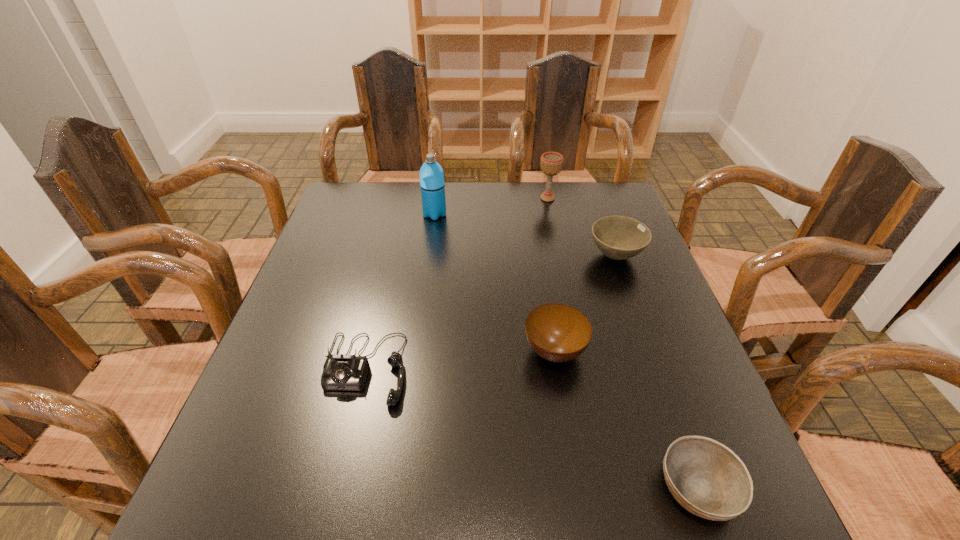
Identify the location of vacant area that lies between the second tallest object and the second nearest bowl. The height and width of the screenshot is (540, 960). (551, 275).

Find the location of a particular element. free spot between the fifth shortest object and the fifth nearest object is located at coordinates (492, 206).

Locate an element on the screen. This screenshot has height=540, width=960. empty space between the third farthest object and the second nearest bowl is located at coordinates (585, 303).

Where is `free spot between the telephone and the nearest bowl`? This screenshot has width=960, height=540. free spot between the telephone and the nearest bowl is located at coordinates (532, 428).

Locate an element on the screen. The height and width of the screenshot is (540, 960). blank region between the shortest object and the leftmost bowl is located at coordinates (626, 419).

Identify which object is located as the third nearest to the telephone. Please provide its 2D coordinates. Your answer should be formatted as a tuple, i.e. [(x, y)], where the tuple contains the x and y coordinates of a point satisfying the conditions above.

[(708, 479)]

At what (x,y) coordinates should I click in order to perform the action: click on object that is the fourth closest one to the farthest object. Please return your answer as a coordinate pair (x, y). Looking at the image, I should click on (345, 372).

I want to click on bowl that is the second closest to the second nearest bowl, so click(618, 237).

Find the location of a particular element. This screenshot has height=540, width=960. the closest bowl to the nearest bowl is located at coordinates (557, 332).

Where is `free point that satisfies the following two spatial constraints: 1. on the front side of the thermos bottle; 2. on the left side of the second nearest bowl`? Image resolution: width=960 pixels, height=540 pixels. free point that satisfies the following two spatial constraints: 1. on the front side of the thermos bottle; 2. on the left side of the second nearest bowl is located at coordinates (417, 351).